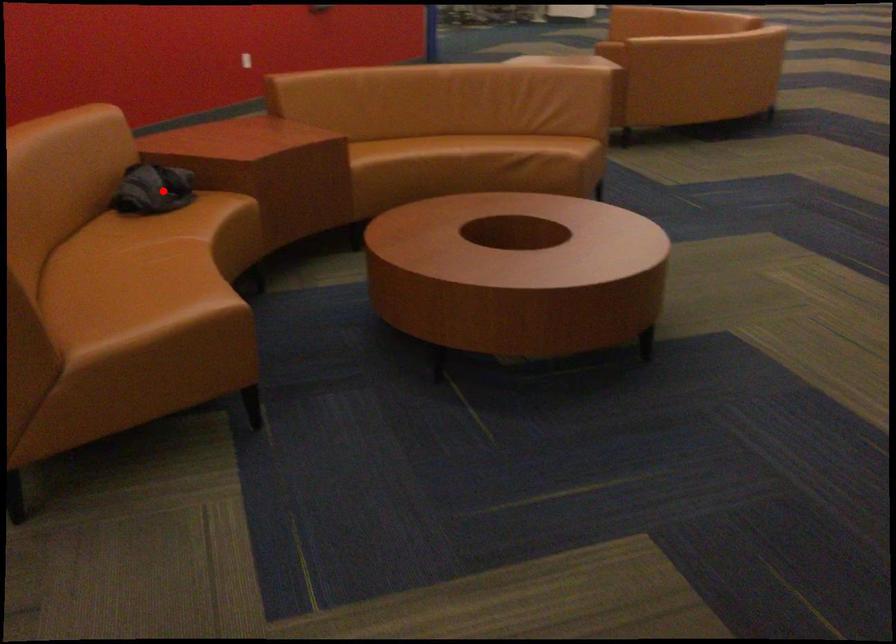
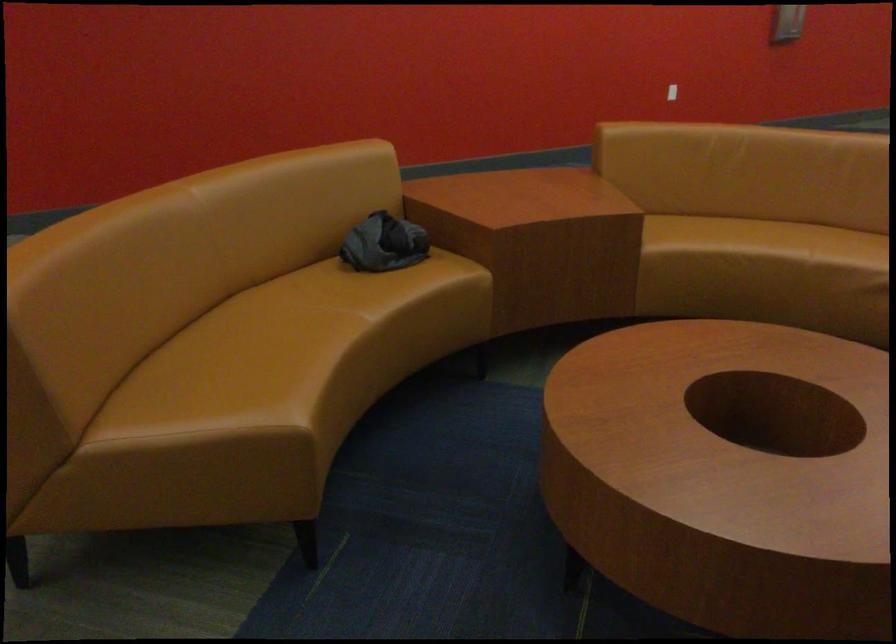
Find the pixel in the second image that matches the highlighted location in the first image.

(383, 243)